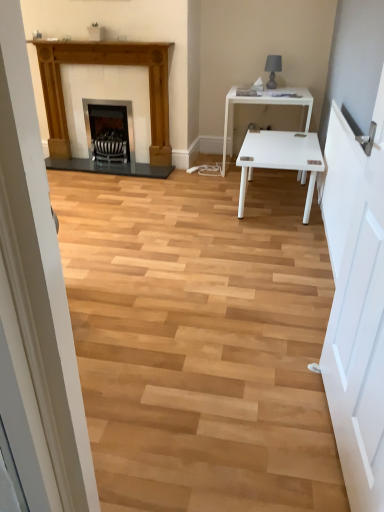
Where is `vacant space behind white wooden door at right`? vacant space behind white wooden door at right is located at coordinates (275, 350).